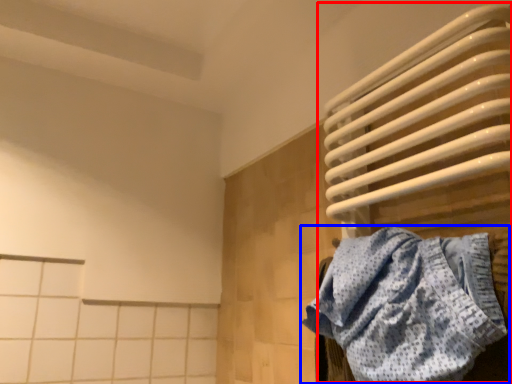
Question: Which of the following is the closest to the observer, water heater (highlighted by a red box) or towel (highlighted by a blue box)?

Choices:
 (A) water heater
 (B) towel

Answer: (B)